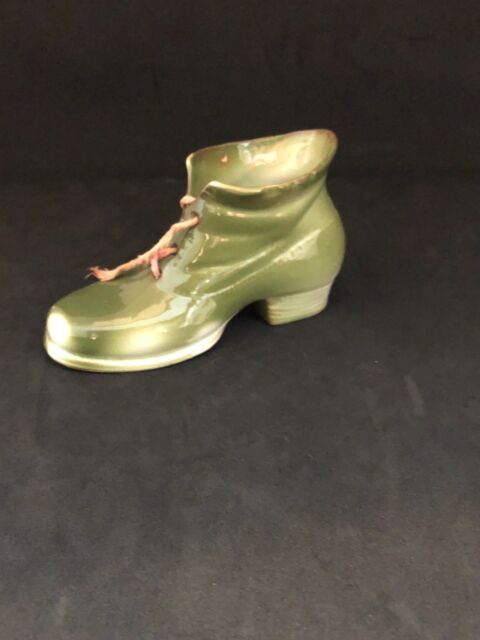
Identify the location of lace. The image size is (480, 640). (176, 226).